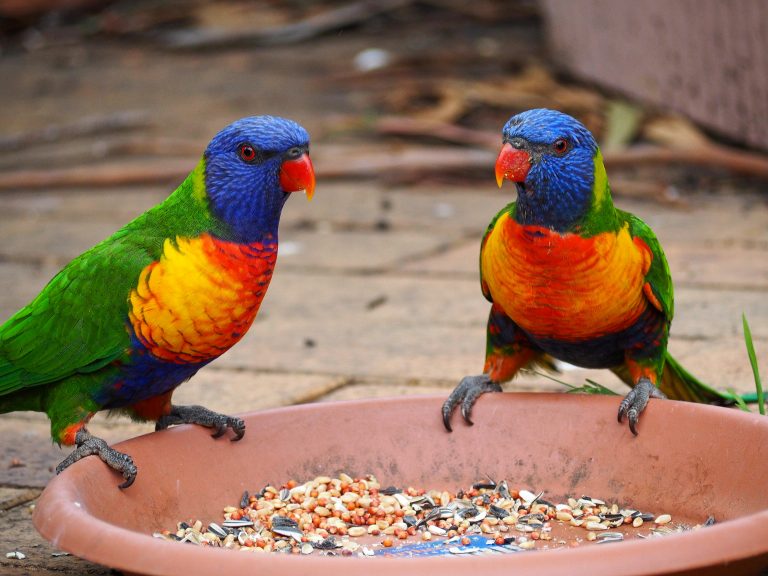
Where is `rim of dish`? This screenshot has height=576, width=768. rim of dish is located at coordinates [328, 401], [581, 564].